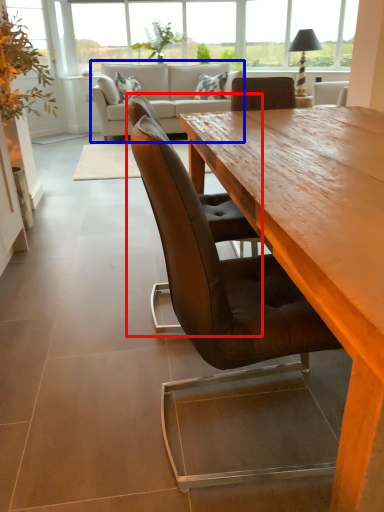
Question: Which point is further to the camera, chair (highlighted by a red box) or studio couch (highlighted by a blue box)?

Choices:
 (A) chair
 (B) studio couch

Answer: (B)